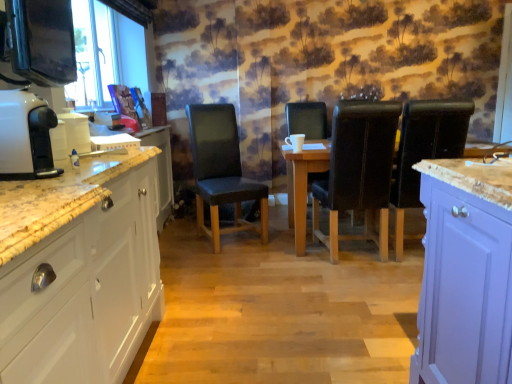
Question: Does black leather chair at center, which appears as the 3th chair when viewed from the right, lie in front of wooden table at center?

Choices:
 (A) yes
 (B) no

Answer: (B)

Question: From a real-world perspective, does black leather chair at center, which appears as the 3th chair when viewed from the right, stand above wooden table at center?

Choices:
 (A) yes
 (B) no

Answer: (A)

Question: Is black leather chair at center, the 2th chair from the left, further to the viewer compared to wooden table at center?

Choices:
 (A) no
 (B) yes

Answer: (B)

Question: Does black leather chair at center, which appears as the 3th chair when viewed from the right, touch wooden table at center?

Choices:
 (A) yes
 (B) no

Answer: (B)

Question: From a real-world perspective, does black leather chair at center, the 2th chair from the left, sit lower than wooden table at center?

Choices:
 (A) no
 (B) yes

Answer: (A)

Question: Is black leather chair at center, the 2th chair from the left, to the right of wooden table at center from the viewer's perspective?

Choices:
 (A) yes
 (B) no

Answer: (B)

Question: Is wooden table at center completely or partially inside black leather chair at right, placed as the 4th chair when sorted from left to right?

Choices:
 (A) no
 (B) yes

Answer: (A)

Question: Considering the relative sizes of black leather chair at right, the first chair in the right-to-left sequence, and wooden table at center in the image provided, is black leather chair at right, the first chair in the right-to-left sequence, wider than wooden table at center?

Choices:
 (A) no
 (B) yes

Answer: (A)

Question: From the image's perspective, is black leather chair at right, placed as the 4th chair when sorted from left to right, located beneath wooden table at center?

Choices:
 (A) yes
 (B) no

Answer: (B)

Question: From a real-world perspective, does black leather chair at right, the first chair in the right-to-left sequence, sit lower than wooden table at center?

Choices:
 (A) no
 (B) yes

Answer: (A)

Question: Is black leather chair at right, the first chair in the right-to-left sequence, bigger than wooden table at center?

Choices:
 (A) no
 (B) yes

Answer: (A)

Question: Is black leather chair at right, placed as the 4th chair when sorted from left to right, facing towards wooden table at center?

Choices:
 (A) yes
 (B) no

Answer: (A)

Question: Is white glossy cabinet at left facing towards black leather chair at center, which appears as the 3th chair when viewed from the right?

Choices:
 (A) no
 (B) yes

Answer: (A)